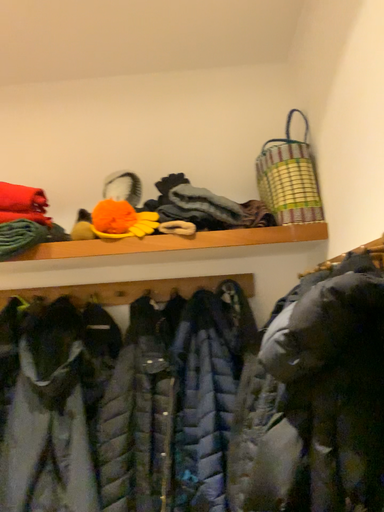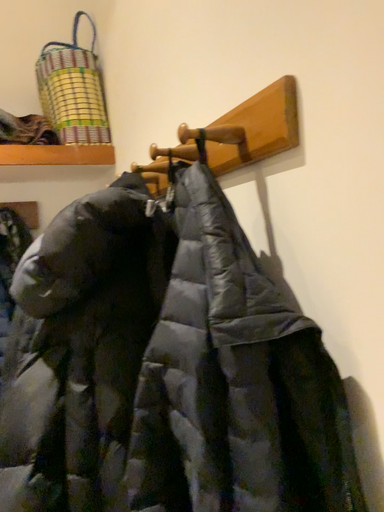
Question: Which way did the camera rotate in the video?

Choices:
 (A) rotated left
 (B) rotated right

Answer: (B)